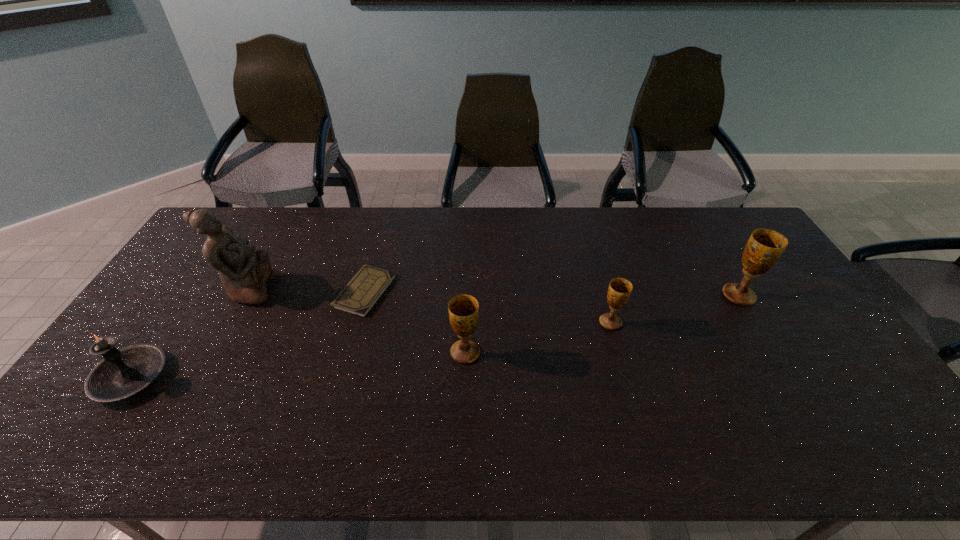
The width and height of the screenshot is (960, 540). In order to click on vacant space that is in between the figurine and the shortest object in this screenshot , I will do `click(307, 291)`.

Locate an element on the screen. vacant area between the second object from left to right and the fifth object from left to right is located at coordinates (430, 306).

In order to click on vacant space in between the second chalice from left to right and the rightmost chalice in this screenshot , I will do `click(675, 309)`.

You are a GUI agent. You are given a task and a screenshot of the screen. Output one action in this format:
    pyautogui.click(x=<x>, y=<y>)
    Task: Click on the free space between the second farthest chalice and the third object from left to right
    This screenshot has width=960, height=540.
    Given the screenshot: What is the action you would take?
    pyautogui.click(x=488, y=307)

At what (x,y) coordinates should I click in order to perform the action: click on vacant area that lies between the fourth object from right to left and the second shortest chalice. Please return your answer as a coordinate pair (x, y). The width and height of the screenshot is (960, 540). Looking at the image, I should click on (415, 322).

The height and width of the screenshot is (540, 960). I want to click on free space that is in between the leftmost object and the farthest chalice, so click(435, 336).

Identify which object is the third nearest to the candle. Please provide its 2D coordinates. Your answer should be formatted as a tuple, i.e. [(x, y)], where the tuple contains the x and y coordinates of a point satisfying the conditions above.

[(463, 309)]

Identify the location of object that stands as the third closest to the tallest chalice. Image resolution: width=960 pixels, height=540 pixels. (359, 296).

Point out which chalice is positioned as the nearest to the second nearest chalice. Please provide its 2D coordinates. Your answer should be formatted as a tuple, i.e. [(x, y)], where the tuple contains the x and y coordinates of a point satisfying the conditions above.

[(764, 248)]

Locate an element on the screen. chalice that stands as the closest to the candle is located at coordinates (463, 309).